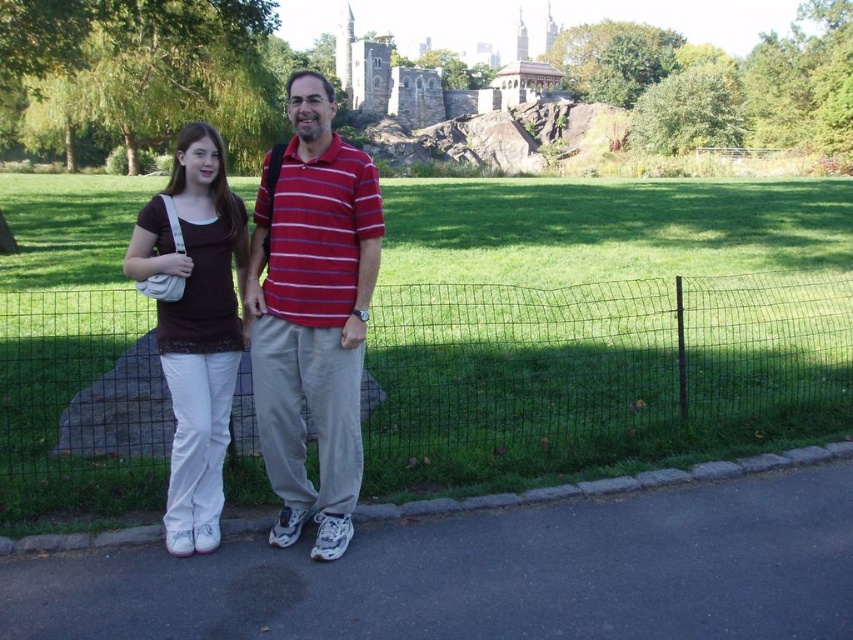
You are standing in the park and want to take a photo of the wire mesh fence at center. Where should you position yourself to ensure the fence is centered in your camera viewfinder?

To center the wire mesh fence at center in your camera viewfinder, position yourself directly in front of it at the point corresponding to its 2D location at [598,372].

You are a photographer trying to capture a photo of the matte white pants at center without the wire mesh fence at center appearing in the foreground. Is this possible based on their positions?

The wire mesh fence at center is above the matte white pants at center, so the fence is positioned in front of the pants. This means the fence would block the view of the pants, making it impossible to capture the pants without the fence in the foreground.

You are a photographer trying to capture a photo of the two people in the park. You need to ensure that the matte red striped polo shirt at center and the matte white pants at center are both visible in the frame. Based on their positions, which one should you focus on first to ensure both are in the shot?

Since the matte red striped polo shirt at center is to the right of the matte white pants at center, you should focus on the matte white pants at center first to ensure both are included in the frame.